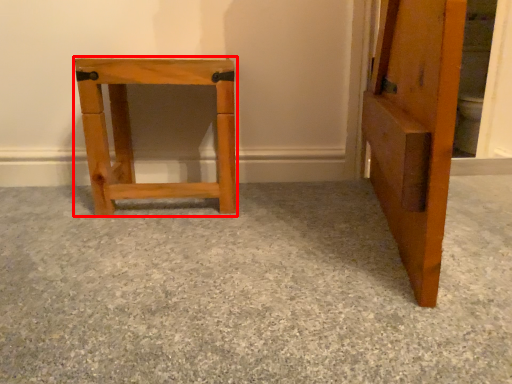
Question: From the image's perspective, where is furniture (annotated by the red box) located in relation to concrete in the image?

Choices:
 (A) below
 (B) above

Answer: (B)